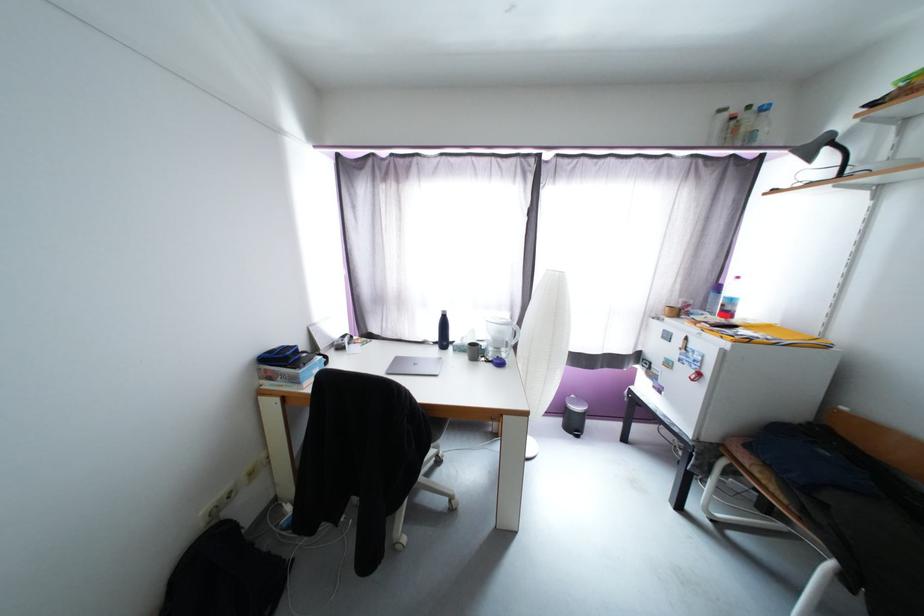
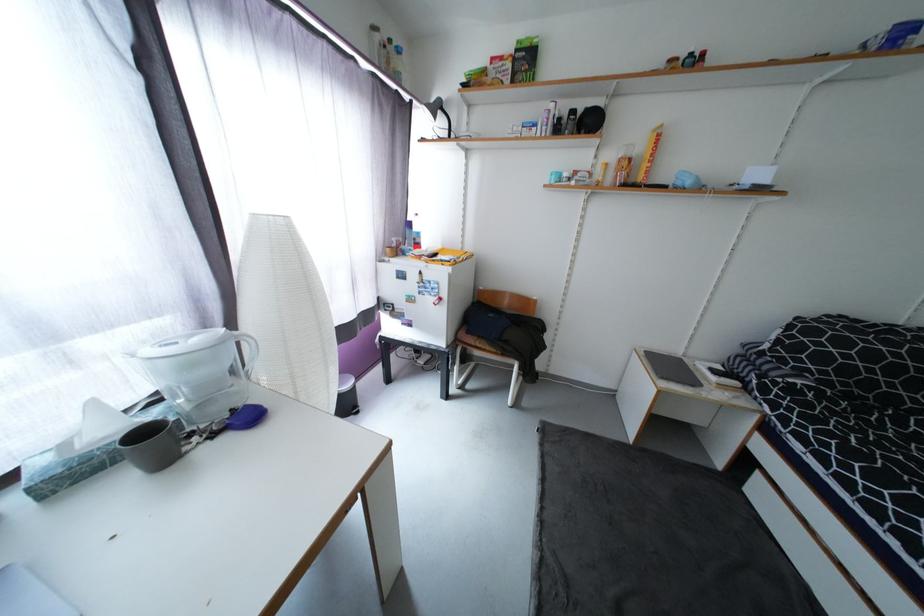
Locate, in the second image, the point that corresponds to pixel 479 333 in the first image.

(102, 407)